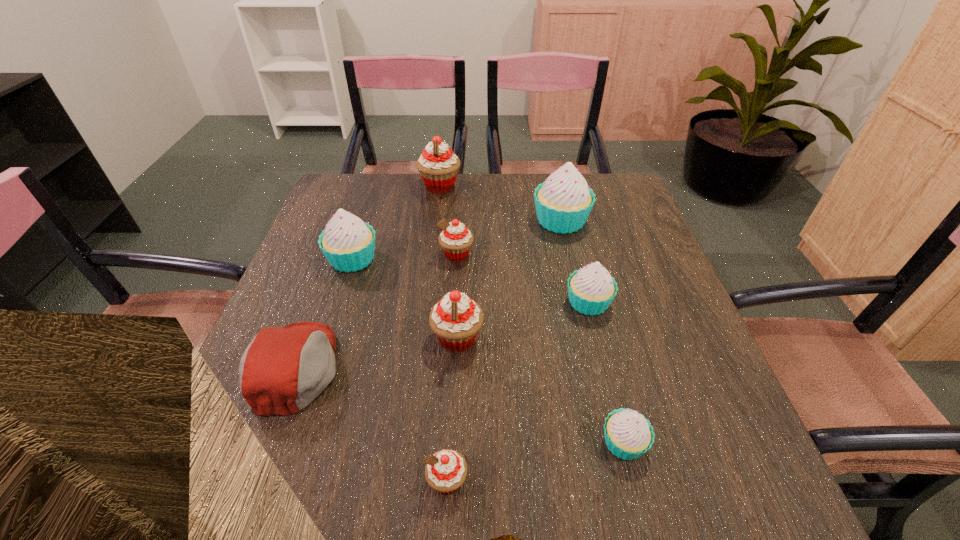
You are a GUI agent. You are given a task and a screenshot of the screen. Output one action in this format:
    pyautogui.click(x=<x>, y=<y>)
    Task: Click on the vacant space positioned on the right of the nearest pink cupcake
    This screenshot has height=540, width=960.
    Given the screenshot: What is the action you would take?
    pyautogui.click(x=597, y=481)

Locate an element on the screen. cupcake that is positioned at the left edge is located at coordinates (348, 243).

This screenshot has height=540, width=960. Identify the location of cap that is positioned at the left edge. (282, 370).

This screenshot has height=540, width=960. In order to click on object that is at the far right corner in this screenshot , I will do `click(563, 202)`.

Find the location of a particular element. This screenshot has width=960, height=540. vacant space at the far edge of the desktop is located at coordinates (518, 190).

Where is `vacant space at the near edge`? This screenshot has width=960, height=540. vacant space at the near edge is located at coordinates (451, 506).

The width and height of the screenshot is (960, 540). I want to click on free space at the left edge of the desktop, so click(314, 249).

Locate an element on the screen. vacant space at the right edge of the desktop is located at coordinates (699, 432).

This screenshot has height=540, width=960. What are the coordinates of `free space at the near left corner of the desktop` in the screenshot? It's located at (217, 477).

You are a GUI agent. You are given a task and a screenshot of the screen. Output one action in this format:
    pyautogui.click(x=<x>, y=<y>)
    Task: Click on the free region at the far right corner of the desktop
    The width and height of the screenshot is (960, 540).
    Given the screenshot: What is the action you would take?
    pyautogui.click(x=630, y=201)